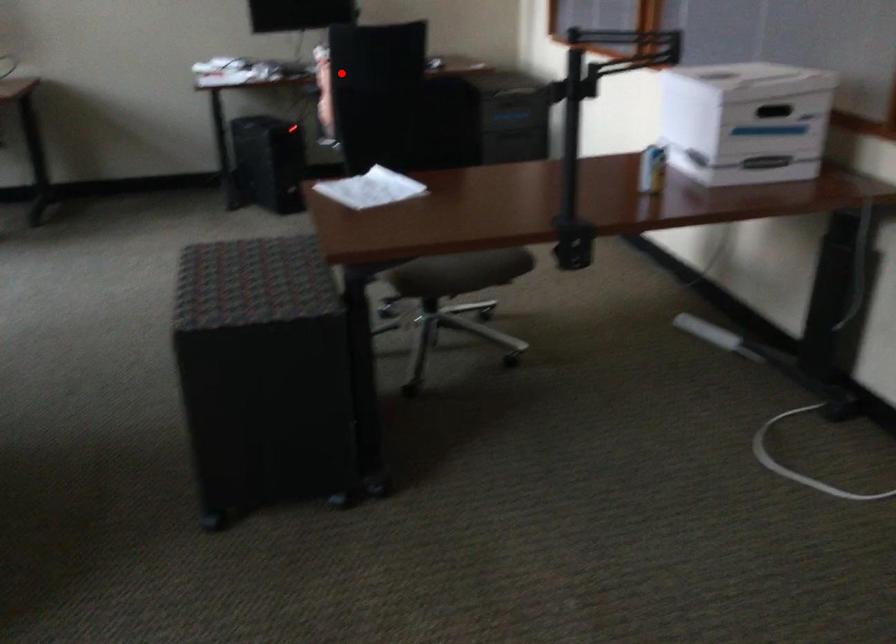
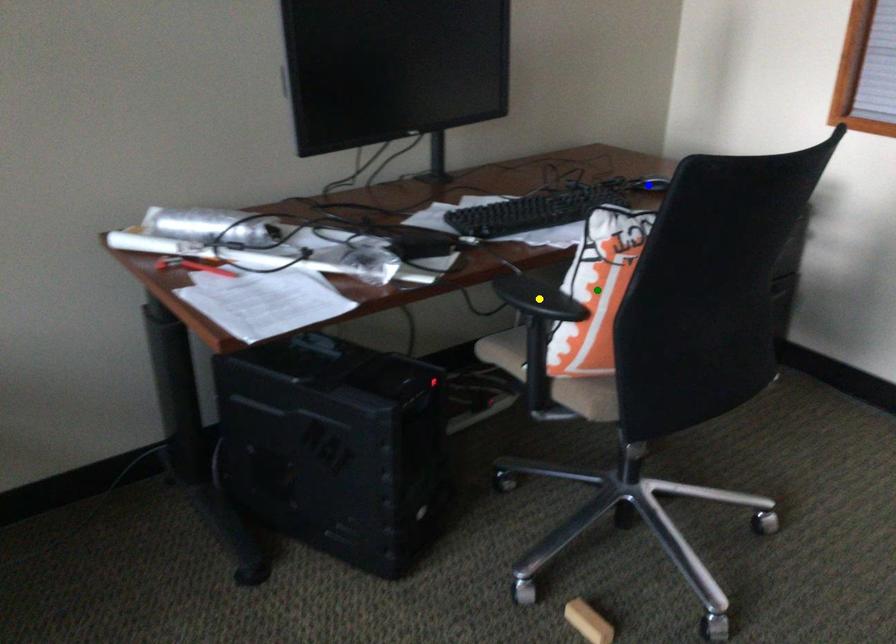
Question: I am providing you with two images of the same scene from different viewpoints. A red point is marked on the first image. You are given multiple points on the second image. Which point in image 2 is actually the same real-world point as the red point in image 1?

Choices:
 (A) green point
 (B) yellow point
 (C) blue point

Answer: (A)